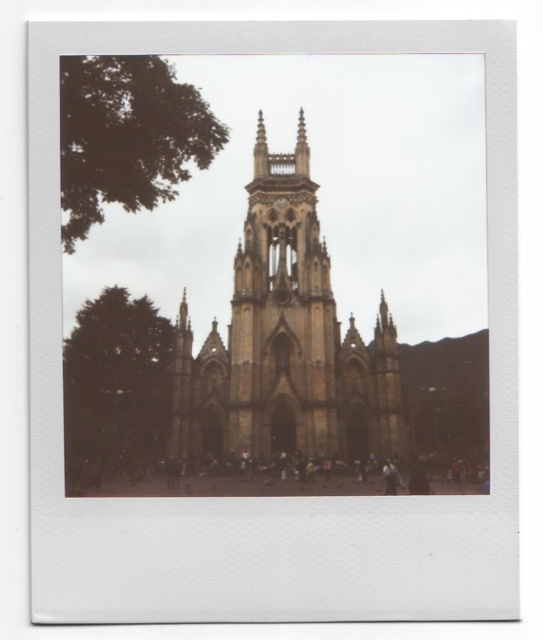
You are standing in front of the Gothic church and want to walk from point A to point B. Point A is at coordinate point (312, 205) and point B is at coordinate point (157, 148). Since the ground is uneven, you need to know which direction to walk. Which point is closer to you, point A or point B?

Point A at coordinate point (312, 205) is closer to you than point B at coordinate point (157, 148) because it is further to the viewer, meaning it is physically nearer in the scene.

Consider the image. You are standing in front of the brown stone church at center and want to take a photo of the green leafy tree at upper left. Since the church is in the way, will you need to move closer to the tree to frame it properly?

The brown stone church at center is taller than the green leafy tree at upper left, so you will need to move closer to the green leafy tree at upper left to frame it properly as the church might block part of the tree if you are too far away.